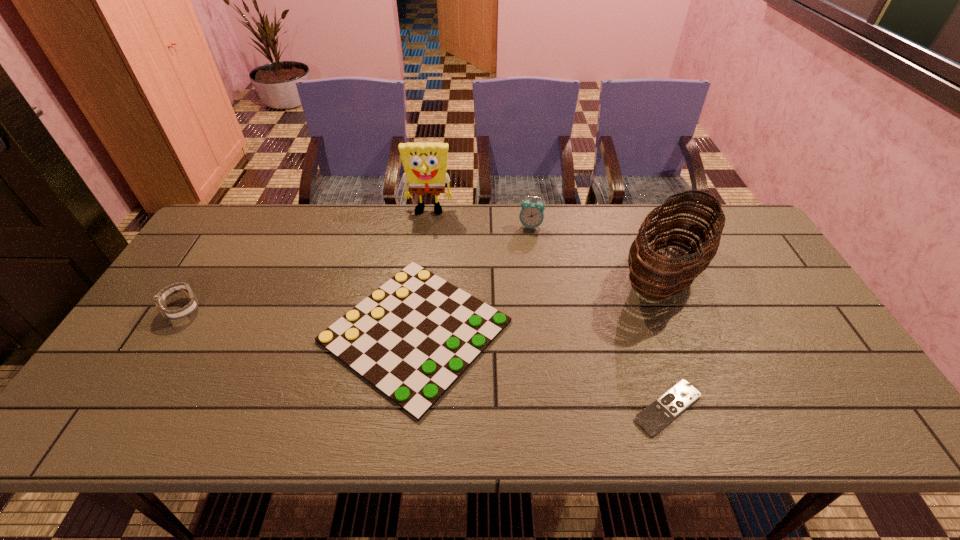
Where is `vacant area between the farthest object and the alarm clock`? vacant area between the farthest object and the alarm clock is located at coordinates (480, 219).

Locate an element on the screen. Image resolution: width=960 pixels, height=540 pixels. vacant region between the basket and the remote control is located at coordinates (666, 341).

The height and width of the screenshot is (540, 960). I want to click on blank region between the alarm clock and the tallest object, so click(480, 219).

The width and height of the screenshot is (960, 540). What are the coordinates of `free space that is in between the fifth shortest object and the remote control` in the screenshot? It's located at (666, 341).

Select which object appears as the second closest to the shortest object. Please provide its 2D coordinates. Your answer should be formatted as a tuple, i.e. [(x, y)], where the tuple contains the x and y coordinates of a point satisfying the conditions above.

[(412, 338)]

Locate an element on the screen. the fifth closest object to the third object from right to left is located at coordinates pos(160,299).

The width and height of the screenshot is (960, 540). I want to click on blank area in the image that satisfies the following two spatial constraints: 1. on the face of the shortest object; 2. on the left side of the third object from right to left, so click(554, 408).

Locate an element on the screen. This screenshot has height=540, width=960. vacant area in the image that satisfies the following two spatial constraints: 1. on the back side of the second shortest object; 2. on the right side of the basket is located at coordinates (422, 274).

Where is `vacant area that satisfies the following two spatial constraints: 1. on the face of the shortest object; 2. on the left side of the tallest object`? The height and width of the screenshot is (540, 960). vacant area that satisfies the following two spatial constraints: 1. on the face of the shortest object; 2. on the left side of the tallest object is located at coordinates (x=402, y=408).